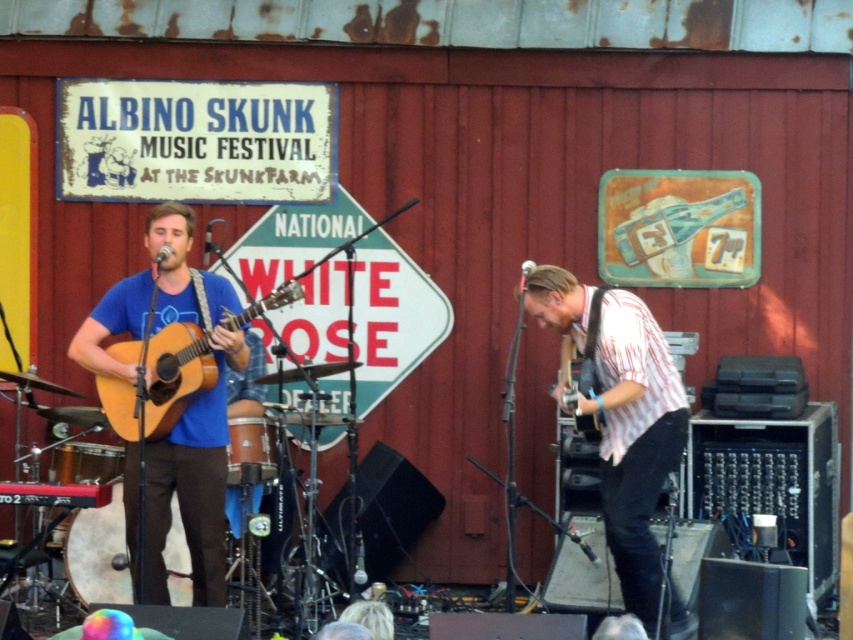
Question: Is white striped shirt at center smaller than matte black electric guitar at right?

Choices:
 (A) no
 (B) yes

Answer: (A)

Question: From the image, what is the correct spatial relationship of white striped shirt at center in relation to matte wood guitar at left?

Choices:
 (A) below
 (B) above

Answer: (A)

Question: Which object appears closest to the camera in this image?

Choices:
 (A) matte blue shirt at left
 (B) matte black electric guitar at right

Answer: (A)

Question: Which object is closer to the camera taking this photo?

Choices:
 (A) white striped shirt at center
 (B) matte black electric guitar at right

Answer: (A)

Question: Can you confirm if matte blue shirt at left is positioned to the left of matte wood guitar at left?

Choices:
 (A) yes
 (B) no

Answer: (A)

Question: Which of the following is the farthest from the observer?

Choices:
 (A) (192, 339)
 (B) (560, 356)
 (C) (134, 490)
 (D) (595, 356)

Answer: (B)